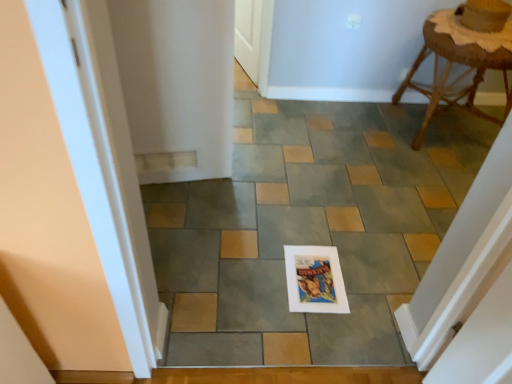
Question: Considering their positions, is rattan stool at upper right located in front of or behind white paper at center?

Choices:
 (A) front
 (B) behind

Answer: (B)

Question: Is rattan stool at upper right spatially inside white paper at center, or outside of it?

Choices:
 (A) inside
 (B) outside

Answer: (B)

Question: Looking at the image, does rattan stool at upper right seem bigger or smaller compared to white paper at center?

Choices:
 (A) big
 (B) small

Answer: (B)

Question: Visually, is white paper at center positioned to the left or to the right of rattan stool at upper right?

Choices:
 (A) left
 (B) right

Answer: (A)

Question: Considering the positions of white paper at center and rattan stool at upper right in the image, is white paper at center taller or shorter than rattan stool at upper right?

Choices:
 (A) tall
 (B) short

Answer: (B)

Question: Does point (242, 329) appear closer or farther from the camera than point (449, 89)?

Choices:
 (A) farther
 (B) closer

Answer: (B)

Question: Looking at the image, does white paper at center seem bigger or smaller compared to rattan stool at upper right?

Choices:
 (A) big
 (B) small

Answer: (A)